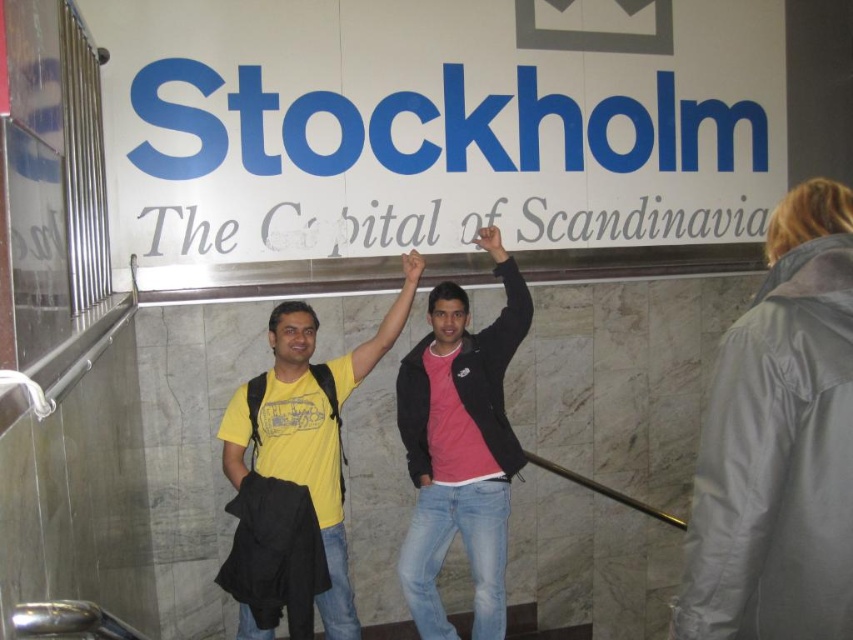
Question: Is pink matte jacket at center to the left of yellow matte t-shirt at center from the viewer's perspective?

Choices:
 (A) yes
 (B) no

Answer: (B)

Question: Which point appears closest to the camera in this image?

Choices:
 (A) (477, 371)
 (B) (376, 340)

Answer: (A)

Question: Does pink matte jacket at center appear under yellow matte t-shirt at center?

Choices:
 (A) yes
 (B) no

Answer: (A)

Question: Does pink matte jacket at center have a greater width compared to yellow matte t-shirt at center?

Choices:
 (A) no
 (B) yes

Answer: (A)